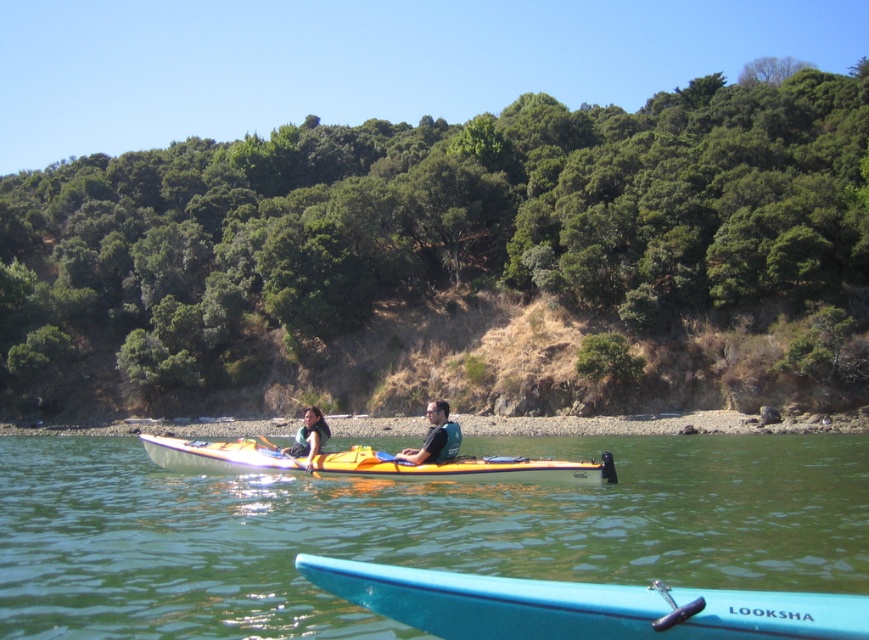
Question: Which object appears closest to the camera in this image?

Choices:
 (A) orange kayak at center
 (B) orange plastic kayak at center
 (C) yellow plastic paddle at center

Answer: (B)

Question: Observing the image, what is the correct spatial positioning of green grassy shoreline at center in reference to yellow plastic paddle at center?

Choices:
 (A) above
 (B) below

Answer: (B)

Question: Which point is closer to the camera?

Choices:
 (A) orange plastic kayak at center
 (B) yellow plastic paddle at center
 (C) blue plastic canoe at lower center
 (D) green grassy shoreline at center

Answer: (C)

Question: From the image, what is the correct spatial relationship of orange kayak at center in relation to matte blue life vest at center?

Choices:
 (A) left
 (B) right

Answer: (A)

Question: Is blue plastic kayak at center thinner than matte blue life vest at center?

Choices:
 (A) no
 (B) yes

Answer: (A)

Question: Which object is the closest to the orange plastic kayak at center?

Choices:
 (A) yellow plastic paddle at center
 (B) matte blue life vest at center

Answer: (B)